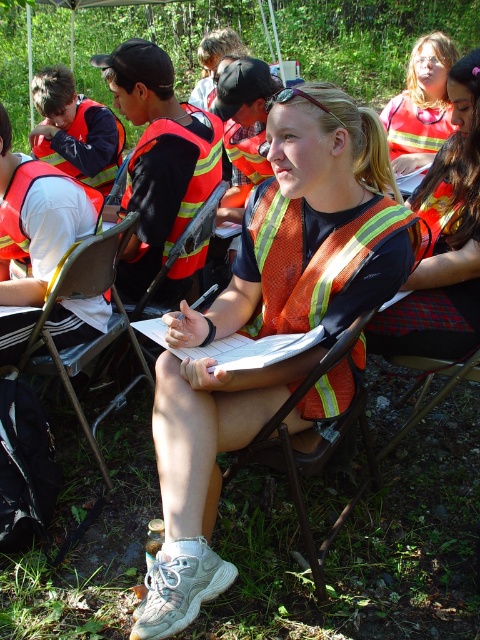
Can you confirm if orange reflective vest at center is shorter than reflective orange vest at center?

No.

Locate an element on the screen. orange reflective vest at center is located at coordinates (269, 321).

Between metallic folding chair at center and matte orange safety vest at upper right, which one is positioned higher?

Positioned higher is matte orange safety vest at upper right.

Based on the photo, can you confirm if metallic folding chair at center is wider than matte orange safety vest at upper right?

Yes, metallic folding chair at center is wider than matte orange safety vest at upper right.

Identify the location of metallic folding chair at center. (312, 449).

In order to click on metallic folding chair at center in this screenshot , I will do `click(312, 449)`.

Can you confirm if reflective orange vest at center is thinner than orange reflective vest at left?

Yes.

Can you confirm if reflective orange vest at center is bigger than orange reflective vest at left?

Yes.

Which is behind, point (414, 204) or point (86, 122)?

The point (86, 122) is behind.

The width and height of the screenshot is (480, 640). Identify the location of reflective orange vest at center. (444, 241).